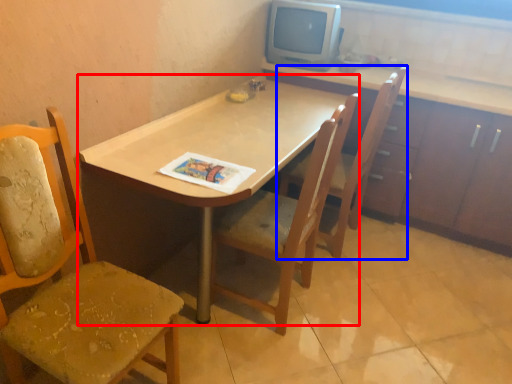
Question: Among these objects, which one is nearest to the camera, desk (highlighted by a red box) or chair (highlighted by a blue box)?

Choices:
 (A) desk
 (B) chair

Answer: (A)